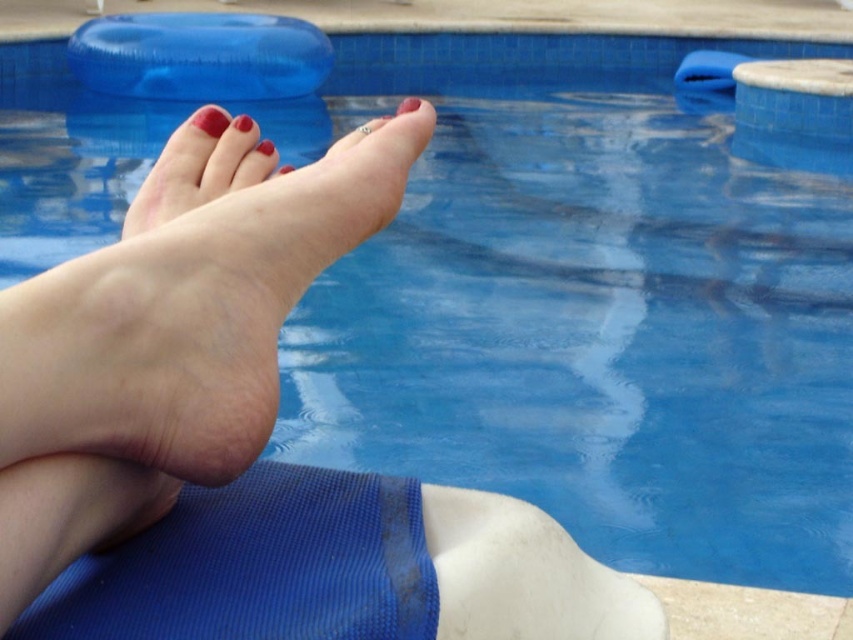
Question: Which of the following is the closest to the observer?

Choices:
 (A) (223, 128)
 (B) (193, 125)
 (C) (416, 108)

Answer: (C)

Question: Is matte skin foot at center above glossy nail polish toe at upper center?

Choices:
 (A) yes
 (B) no

Answer: (B)

Question: Which point appears farthest from the camera in this image?

Choices:
 (A) (213, 124)
 (B) (260, 152)

Answer: (B)

Question: Observing the image, what is the correct spatial positioning of smooth skin foot at center in reference to glossy nail polish toe at upper center?

Choices:
 (A) above
 (B) below

Answer: (B)

Question: Is smooth skin foot at center to the left of glossy nail polish toe at upper center from the viewer's perspective?

Choices:
 (A) no
 (B) yes

Answer: (A)

Question: Which of the following is the closest to the observer?

Choices:
 (A) (254, 150)
 (B) (404, 108)
 (C) (189, 147)
 (D) (286, 170)

Answer: (B)